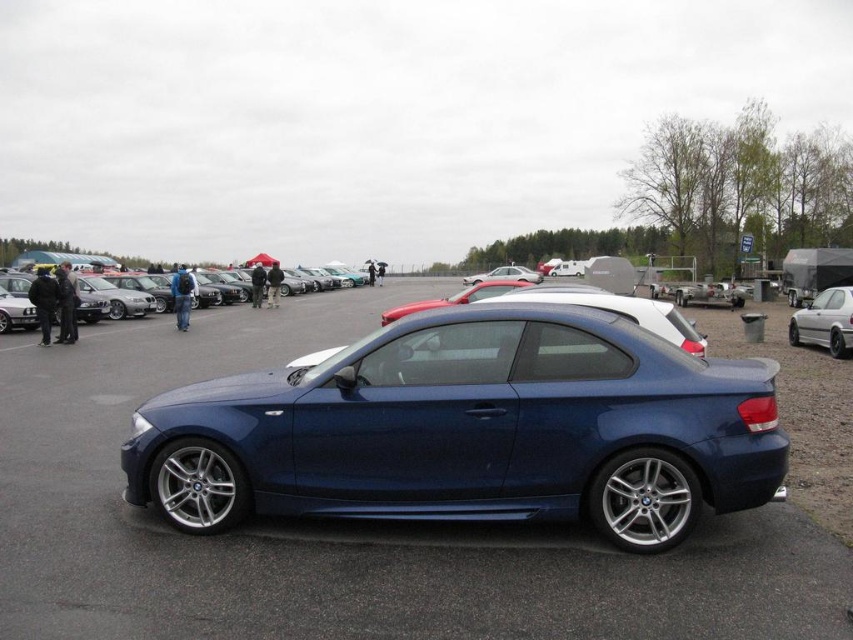
You are a photographer standing in front of the dark blue BMW 1 Series coupe. You want to take a picture that includes both the matte black car at center and the white matte sedan at right. Based on their positions, which car should you focus on first to ensure both are in the frame?

The matte black car at center is above the white matte sedan at right, so you should focus on the matte black car at center first to ensure both are in the frame.

You are a photographer standing at the edge of the car event. You want to take a photo that includes both the metallic blue car at center and the matte black car at center. Given that your camera has a maximum focus range of 15 meters, will you be able to capture both cars in sharp focus?

The distance between the metallic blue car at center and the matte black car at center is 14.20 meters, which is within the camera maximum focus range of 15 meters. Therefore, both cars can be captured in sharp focus.

You are standing at the point with coordinates point (164,296) and want to walk to the entrance of the car event, which is located at point (68,563). Is the entrance in front of or behind you?

The entrance at point (68,563) is in front of you because it is located in front of point (164,296) where you are standing.